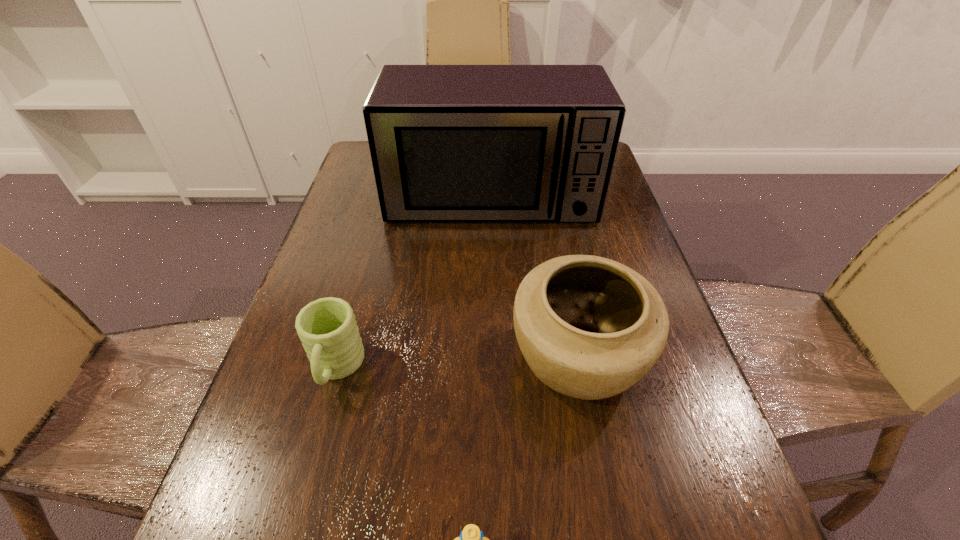
The height and width of the screenshot is (540, 960). In order to click on object that is the third closest one to the nearest object in this screenshot , I will do `click(449, 143)`.

Where is `vacant area in the image that satisfies the following two spatial constraints: 1. on the front-facing side of the second tallest object; 2. on the right side of the microwave_oven`? vacant area in the image that satisfies the following two spatial constraints: 1. on the front-facing side of the second tallest object; 2. on the right side of the microwave_oven is located at coordinates (495, 359).

Image resolution: width=960 pixels, height=540 pixels. I want to click on vacant space that satisfies the following two spatial constraints: 1. on the front-facing side of the third shortest object; 2. on the left side of the microwave_oven, so click(x=495, y=359).

Identify the location of vacant space that satisfies the following two spatial constraints: 1. on the front-facing side of the pottery; 2. on the left side of the farthest object. The width and height of the screenshot is (960, 540). (495, 359).